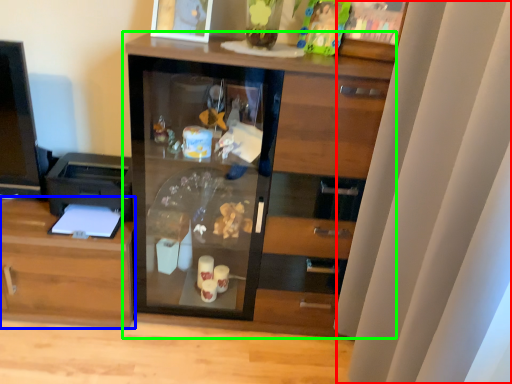
Question: Estimate the real-world distances between objects in this image. Which object is closer to curtain (highlighted by a red box), cabinetry (highlighted by a blue box) or cupboard (highlighted by a green box)?

Choices:
 (A) cabinetry
 (B) cupboard

Answer: (B)